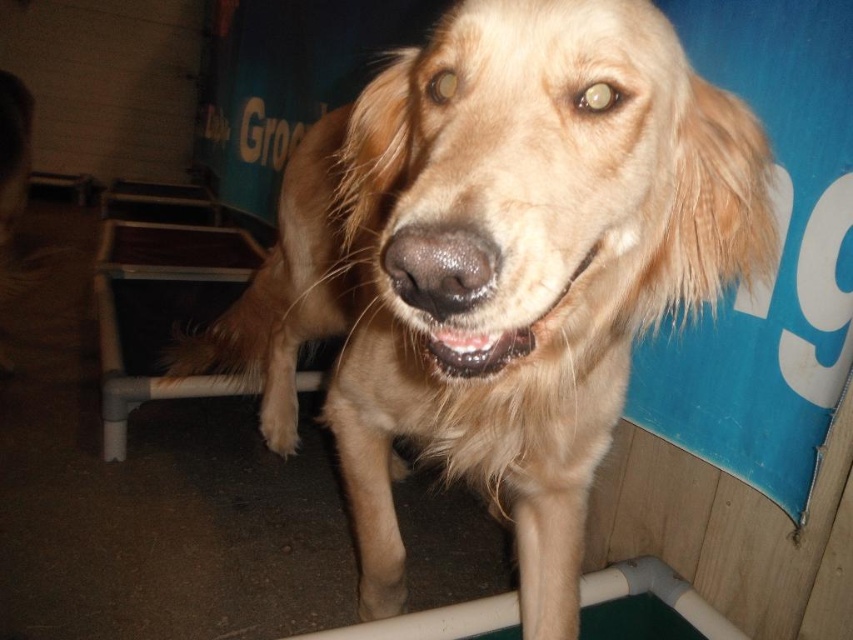
Does golden fur dog at center have a greater width compared to shiny brown teeth at center?

Yes, golden fur dog at center is wider than shiny brown teeth at center.

The width and height of the screenshot is (853, 640). What are the coordinates of `golden fur dog at center` in the screenshot? It's located at (497, 266).